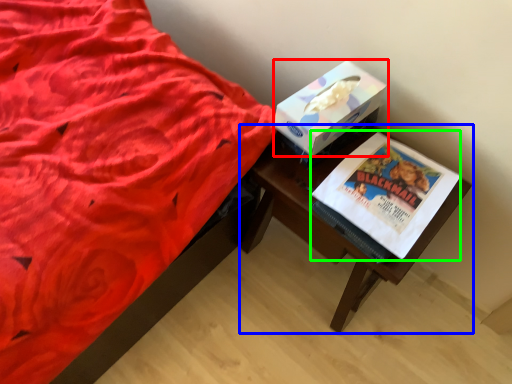
Question: Considering the real-world distances, which object is closest to box (highlighted by a red box)? table (highlighted by a blue box) or paperback book (highlighted by a green box).

Choices:
 (A) table
 (B) paperback book

Answer: (B)